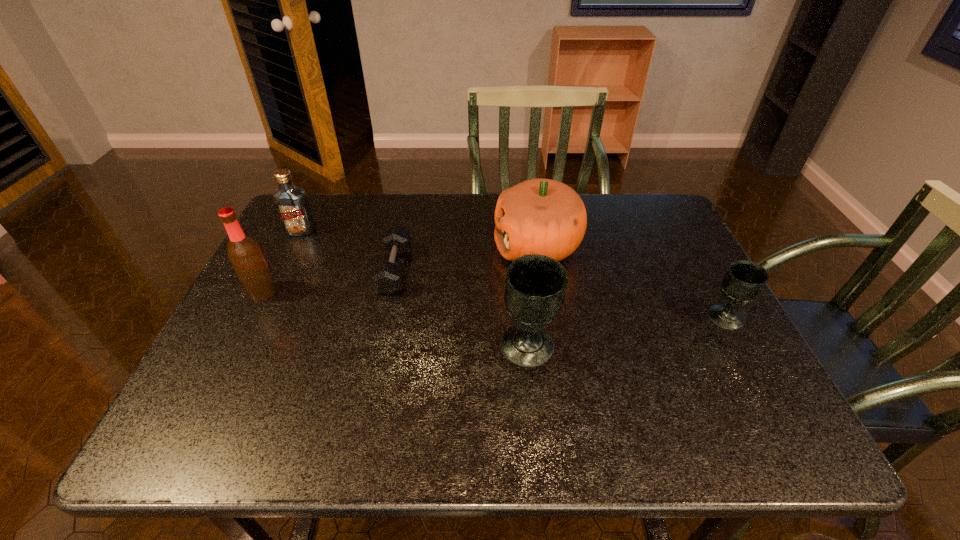
Identify the location of beer bottle that is at the left edge. (244, 253).

The height and width of the screenshot is (540, 960). What are the coordinates of `object situated at the right edge` in the screenshot? It's located at (744, 281).

Image resolution: width=960 pixels, height=540 pixels. In order to click on object that is positioned at the far left corner in this screenshot , I will do `click(291, 202)`.

This screenshot has height=540, width=960. I want to click on free region at the far edge, so click(347, 236).

In the image, there is a desktop. Where is `vacant space at the left edge`? This screenshot has height=540, width=960. vacant space at the left edge is located at coordinates (257, 334).

This screenshot has height=540, width=960. In order to click on free space at the right edge in this screenshot , I will do `click(667, 281)`.

Image resolution: width=960 pixels, height=540 pixels. Find the location of `free location at the far right corner`. free location at the far right corner is located at coordinates (670, 217).

This screenshot has width=960, height=540. In the image, there is a desktop. What are the coordinates of `vacant space at the near right corner` in the screenshot? It's located at (714, 385).

The width and height of the screenshot is (960, 540). I want to click on unoccupied position between the beer bottle and the rightmost object, so click(493, 305).

Identify the location of free space between the beer bottle and the dumbbell. Image resolution: width=960 pixels, height=540 pixels. (328, 281).